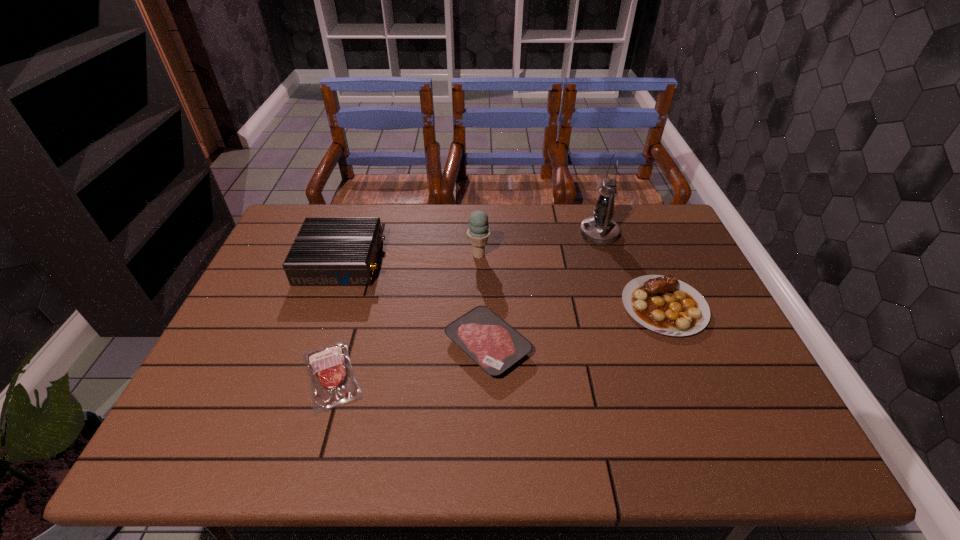
Where is `free space at the far edge of the desktop`? This screenshot has width=960, height=540. free space at the far edge of the desktop is located at coordinates (396, 217).

You are a GUI agent. You are given a task and a screenshot of the screen. Output one action in this format:
    pyautogui.click(x=<x>, y=<y>)
    Task: Click on the vacant space at the near edge of the desktop
    The width and height of the screenshot is (960, 540).
    Given the screenshot: What is the action you would take?
    pyautogui.click(x=612, y=458)

You are a GUI agent. You are given a task and a screenshot of the screen. Output one action in this format:
    pyautogui.click(x=<x>, y=<y>)
    Task: Click on the vacant space at the left edge of the desktop
    
    Given the screenshot: What is the action you would take?
    pyautogui.click(x=254, y=305)

This screenshot has height=540, width=960. I want to click on vacant space at the right edge, so click(x=685, y=275).

The width and height of the screenshot is (960, 540). I want to click on free space at the far left corner of the desktop, so click(324, 205).

Find the location of `vacant space that is in between the fourth shortest object and the rightmost steak`. vacant space that is in between the fourth shortest object and the rightmost steak is located at coordinates (503, 284).

Find the location of a particular element. unoccupied position between the fifth shortest object and the tallest object is located at coordinates point(539,244).

At what (x,y) coordinates should I click in order to perform the action: click on empty space that is in between the fourth shortest object and the second tallest object. Please return your answer as a coordinate pair (x, y). This screenshot has height=540, width=960. Looking at the image, I should click on (410, 258).

Where is `free space between the tallest object and the second steak from right to left`? The height and width of the screenshot is (540, 960). free space between the tallest object and the second steak from right to left is located at coordinates (543, 289).

Where is `vacant area that lies between the tallest steak and the second tallest object`? This screenshot has width=960, height=540. vacant area that lies between the tallest steak and the second tallest object is located at coordinates (571, 281).